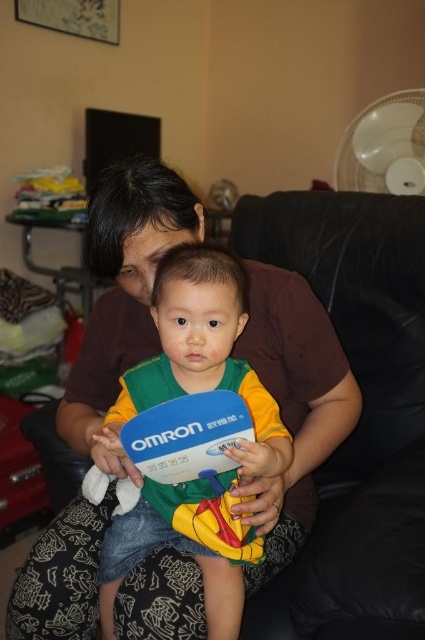
Is black leather couch at center smaller than matte plastic toy at center?

No.

Between black leather couch at center and matte plastic toy at center, which one appears on the right side from the viewer's perspective?

Positioned to the right is black leather couch at center.

At what (x,y) coordinates should I click in order to perform the action: click on black leather couch at center. Please return your answer as a coordinate pair (x, y). This screenshot has width=425, height=640. Looking at the image, I should click on (360, 416).